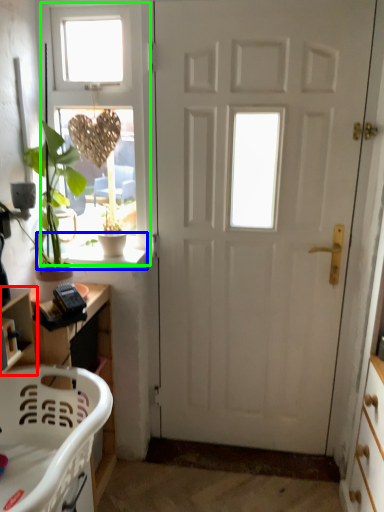
Question: Which object is the closest to the shelf (highlighted by a red box)? Choose among these: window sill (highlighted by a blue box) or window (highlighted by a green box).

Choices:
 (A) window sill
 (B) window

Answer: (A)